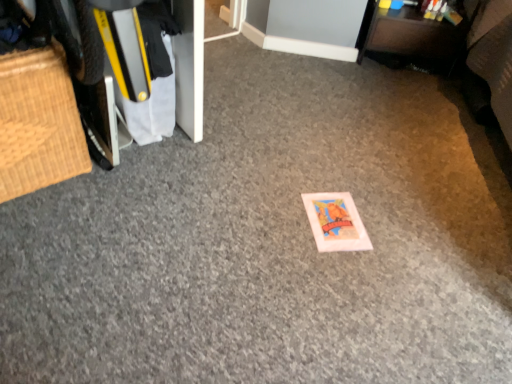
Question: Considering the positions of point (52, 125) and point (376, 59), is point (52, 125) closer or farther from the camera than point (376, 59)?

Choices:
 (A) farther
 (B) closer

Answer: (B)

Question: In the image, is bamboo mat at left, positioned as the 2th furniture in right-to-left order, positioned in front of or behind brown fabric drawer at upper right, the 2th furniture in the bottom-to-top sequence?

Choices:
 (A) front
 (B) behind

Answer: (A)

Question: Considering the positions of bamboo mat at left, the second furniture in the top-to-bottom sequence, and brown fabric drawer at upper right, arranged as the first furniture when viewed from the back, in the image, is bamboo mat at left, the second furniture in the top-to-bottom sequence, wider or thinner than brown fabric drawer at upper right, arranged as the first furniture when viewed from the back,?

Choices:
 (A) wide
 (B) thin

Answer: (A)

Question: From the image's perspective, is brown fabric drawer at upper right, the 2th furniture in the bottom-to-top sequence, located above or below bamboo mat at left, positioned as the 2th furniture in right-to-left order?

Choices:
 (A) below
 (B) above

Answer: (B)

Question: Considering their positions, is brown fabric drawer at upper right, arranged as the first furniture when viewed from the back, located in front of or behind bamboo mat at left, the second furniture in the top-to-bottom sequence?

Choices:
 (A) behind
 (B) front

Answer: (A)

Question: Is brown fabric drawer at upper right, acting as the first furniture starting from the right, inside the boundaries of bamboo mat at left, marked as the 1th furniture in a left-to-right arrangement, or outside?

Choices:
 (A) inside
 (B) outside

Answer: (B)

Question: From their relative heights in the image, would you say brown fabric drawer at upper right, arranged as the first furniture when viewed from the back, is taller or shorter than bamboo mat at left, which ranks as the first furniture in front-to-back order?

Choices:
 (A) tall
 (B) short

Answer: (B)